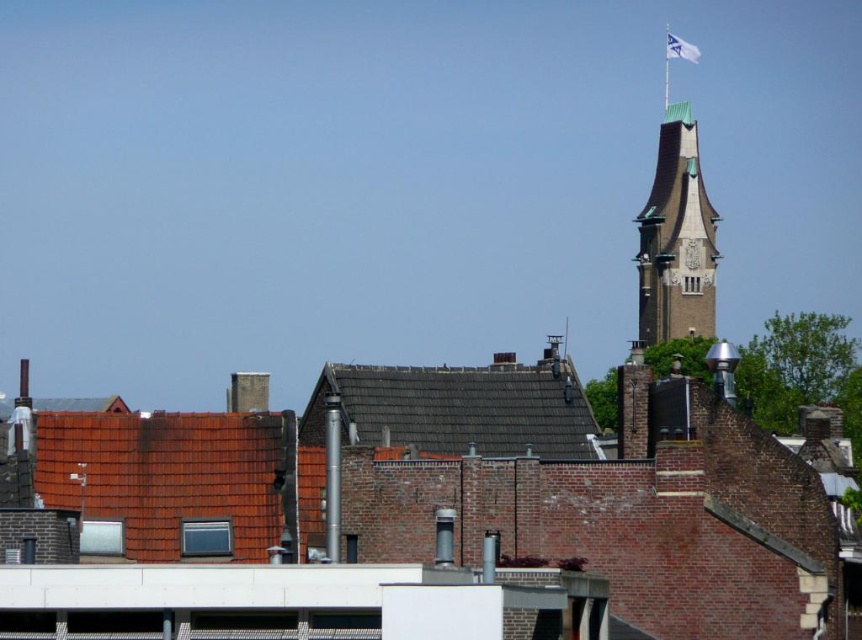
Based on the photo, you are a drone operator trying to capture the brown shingles at center and the white fabric flag at upper right in a single photo. Considering their widths, which object will occupy more space horizontally in the photo?

The brown shingles at center will occupy more space horizontally in the photo because their width surpasses that of the white fabric flag at upper right.

You are a bird flying over the rooftops and want to land on the highest point between the brown stone tower at upper right and the white fabric flag at upper right. Which one should you choose?

The brown stone tower at upper right is larger in size than the white fabric flag at upper right, so the brown stone tower at upper right is taller and would be the highest point for the bird to land.

You are standing on a rooftop and looking out at the scene. You notice the brown shingles at center and the brown stone tower at upper right. Which object is closer to you based on their positions in the image?

The brown shingles at center are closer to you because they are positioned in front of the brown stone tower at upper right.